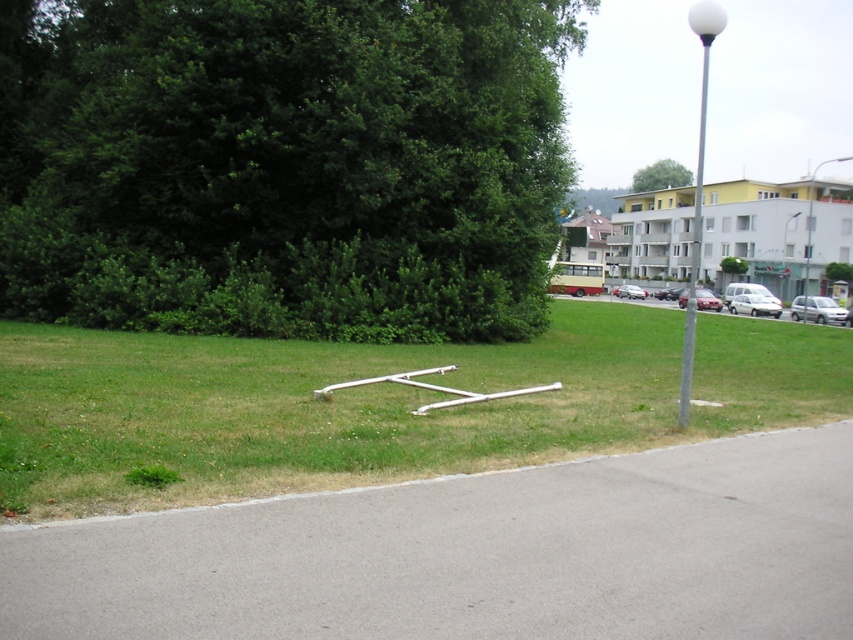
Is green leafy tree at upper left above white glossy sedan at center-right?

Yes.

Identify the location of green leafy tree at upper left. The image size is (853, 640). (283, 164).

This screenshot has width=853, height=640. Identify the location of green leafy tree at upper left. (283, 164).

How much distance is there between white glossy sedan at center-right and metallic silver van at center?

white glossy sedan at center-right is 107.05 feet away from metallic silver van at center.

Does point (769, 305) lie behind point (618, 291)?

That is False.

Image resolution: width=853 pixels, height=640 pixels. What are the coordinates of `white glossy sedan at center-right` in the screenshot? It's located at (753, 305).

Does shiny red car at center appear on the left side of metallic silver van at center?

In fact, shiny red car at center is to the right of metallic silver van at center.

Can you confirm if shiny red car at center is positioned above metallic silver van at center?

No.

Find the location of a particular element. shiny red car at center is located at coordinates (706, 300).